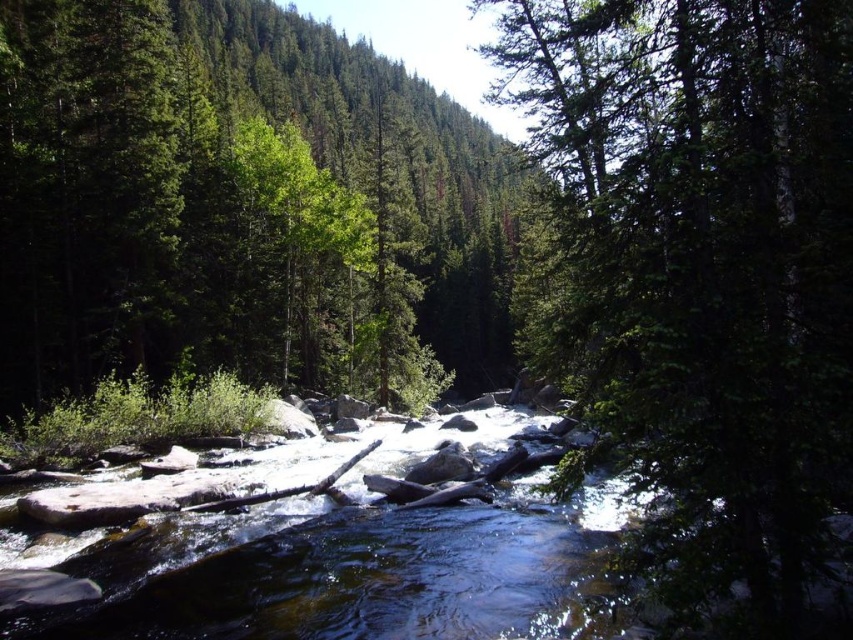
In the scene shown: Does green textured tree at center have a greater height compared to green matte tree at upper center?

No.

The image size is (853, 640). I want to click on green textured tree at center, so click(x=698, y=282).

Locate an element on the screen. This screenshot has height=640, width=853. green textured tree at center is located at coordinates (698, 282).